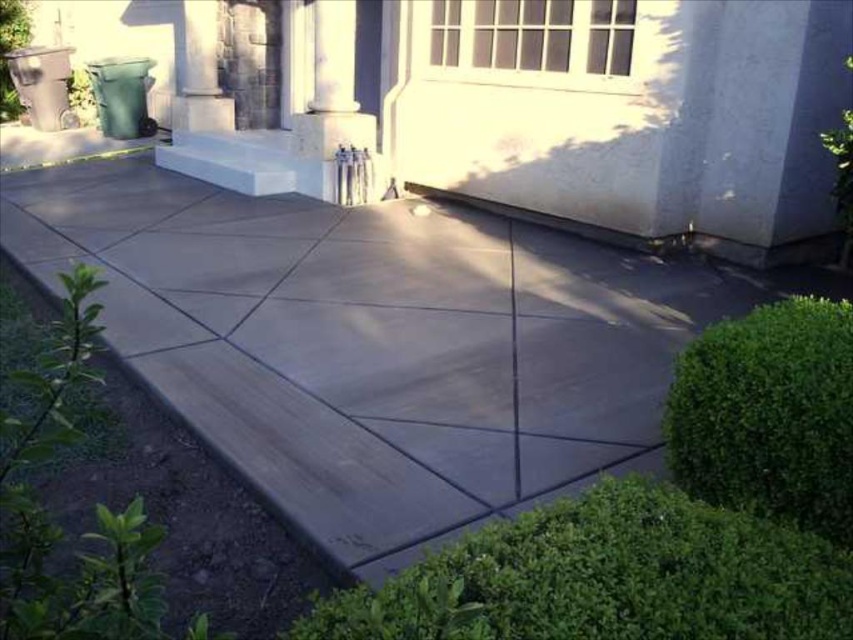
Question: Which is farther from the white smooth column at upper center?

Choices:
 (A) green leafy bush at lower right
 (B) white textured window at upper center

Answer: (A)

Question: Where is green leafy hedge at lower right located in relation to green leafy bush at lower right in the image?

Choices:
 (A) right
 (B) left

Answer: (B)

Question: Can you confirm if green leafy hedge at lower right is positioned below white textured window at upper center?

Choices:
 (A) yes
 (B) no

Answer: (A)

Question: Estimate the real-world distances between objects in this image. Which object is closer to the white textured window at upper center?

Choices:
 (A) white smooth column at upper center
 (B) green leafy hedge at lower right

Answer: (A)

Question: Which of the following is the closest to the observer?

Choices:
 (A) green leafy hedge at lower right
 (B) white smooth column at upper center
 (C) white textured window at upper center
 (D) green leafy bush at lower right

Answer: (A)

Question: Is green leafy hedge at lower right in front of white smooth column at upper center?

Choices:
 (A) no
 (B) yes

Answer: (B)